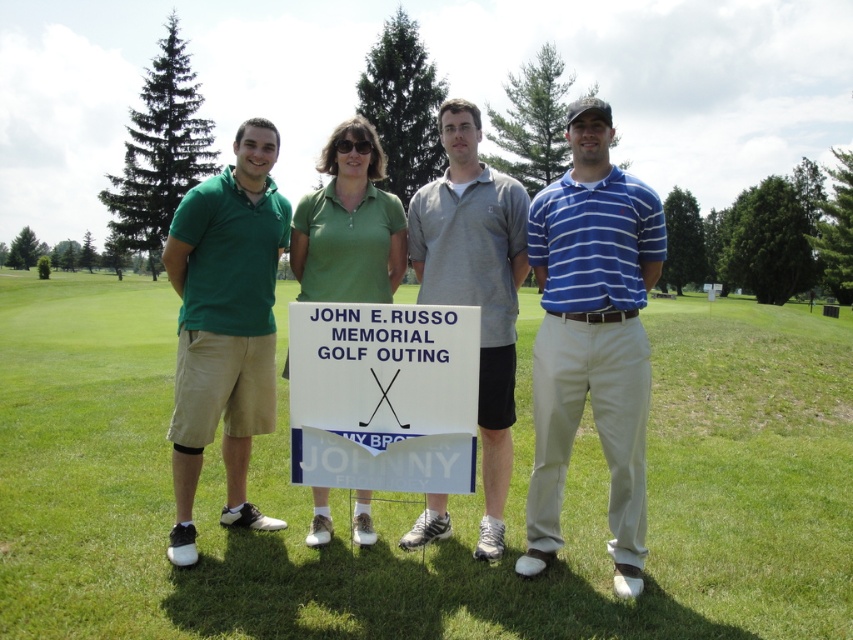
Which is behind, point (445, 404) or point (494, 412)?

The point (494, 412) is more distant.

Is point (350, 344) closer to camera compared to point (474, 132)?

That is True.

Identify the location of white paper sign at center. The width and height of the screenshot is (853, 640). (383, 396).

Is green grass at center smaller than white paper sign at center?

No.

Is green grass at center positioned before white paper sign at center?

No, it is behind white paper sign at center.

What do you see at coordinates (421, 496) in the screenshot? I see `green grass at center` at bounding box center [421, 496].

Locate an element on the screen. This screenshot has width=853, height=640. green grass at center is located at coordinates (421, 496).

Looking at this image, which of these two, white paper sign at center or green matte shirt at center, stands taller?

With more height is white paper sign at center.

Does white paper sign at center appear over green matte shirt at center?

Indeed, white paper sign at center is positioned over green matte shirt at center.

Locate an element on the screen. The width and height of the screenshot is (853, 640). white paper sign at center is located at coordinates (383, 396).

Where is `white paper sign at center`? white paper sign at center is located at coordinates (383, 396).